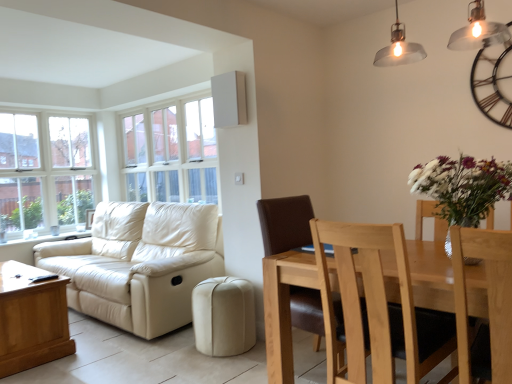
Question: Considering the relative positions of beige leather ottoman at lower center and brown leather chair at center, arranged as the third chair when viewed from the front, in the image provided, is beige leather ottoman at lower center to the left or to the right of brown leather chair at center, arranged as the third chair when viewed from the front,?

Choices:
 (A) left
 (B) right

Answer: (A)

Question: From the image's perspective, is beige leather ottoman at lower center above or below brown leather chair at center, placed as the first chair when sorted from back to front?

Choices:
 (A) below
 (B) above

Answer: (A)

Question: Which of these objects is positioned closest to the beige leather couch at left?

Choices:
 (A) light brown wooden chair at right, which is the third chair from back to front
 (B) metallic black clock at upper right
 (C) beige leather ottoman at lower center
 (D) brown leather chair at center, arranged as the third chair when viewed from the front
 (E) white matte vase at right

Answer: (C)

Question: Considering the real-world distances, which object is closest to the clear glass window at left, the 1th window viewed from the left?

Choices:
 (A) light brown wood chair at lower right, acting as the 2th chair starting from the front
 (B) beige leather couch at left
 (C) white matte vase at right
 (D) beige leather ottoman at lower center
 (E) matte silver pendant light at upper right

Answer: (B)